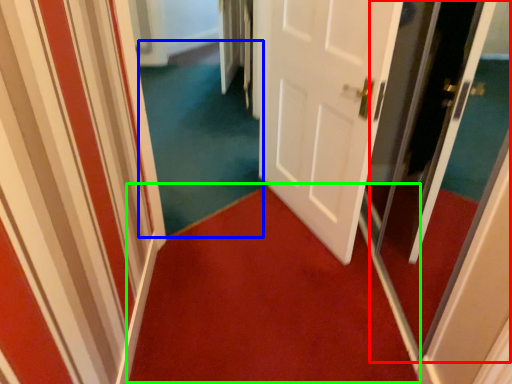
Question: Considering the real-world distances, which object is closest to screen door (highlighted by a red box)? plain (highlighted by a blue box) or doormat (highlighted by a green box).

Choices:
 (A) plain
 (B) doormat

Answer: (B)